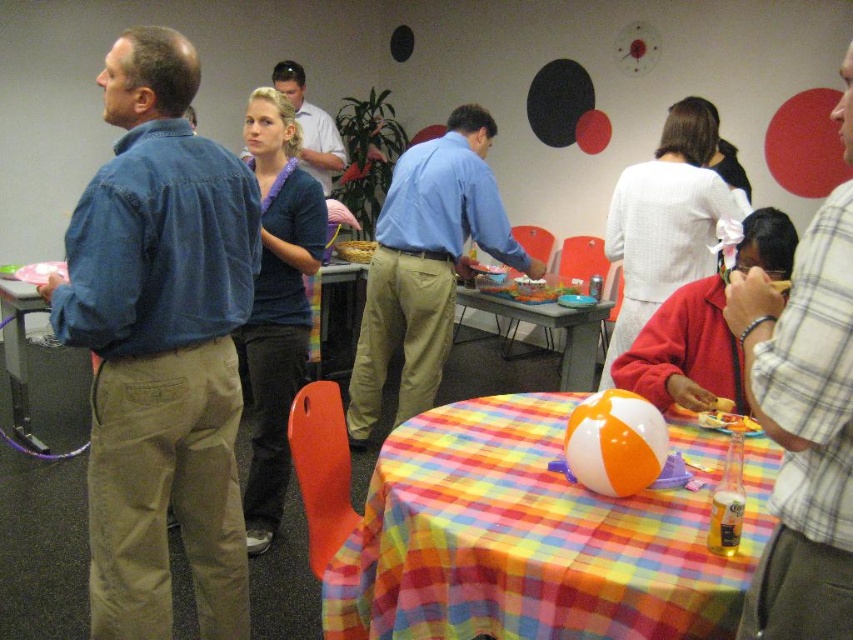
Does smooth plastic toy at center come in front of matte brown cake at center?

Yes, it is in front of matte brown cake at center.

Can you confirm if smooth plastic toy at center is positioned to the left of matte brown cake at center?

No, smooth plastic toy at center is not to the left of matte brown cake at center.

In order to click on smooth plastic toy at center in this screenshot , I will do `click(527, 288)`.

Find the location of a particular element. Image resolution: width=853 pixels, height=640 pixels. smooth plastic toy at center is located at coordinates (527, 288).

Who is shorter, matte blue shirt at center or plastic table at center?

plastic table at center is shorter.

Can you confirm if matte blue shirt at center is thinner than plastic table at center?

In fact, matte blue shirt at center might be wider than plastic table at center.

Is point (425, 364) in front of point (543, 324)?

Yes.

Find the location of a particular element. This screenshot has height=640, width=853. matte blue shirt at center is located at coordinates (426, 266).

Who is higher up, denim shirt at left or orange/beach ball at center?

denim shirt at left is above.

Find the location of a particular element. The image size is (853, 640). denim shirt at left is located at coordinates (160, 346).

This screenshot has height=640, width=853. In order to click on denim shirt at left in this screenshot , I will do `click(160, 346)`.